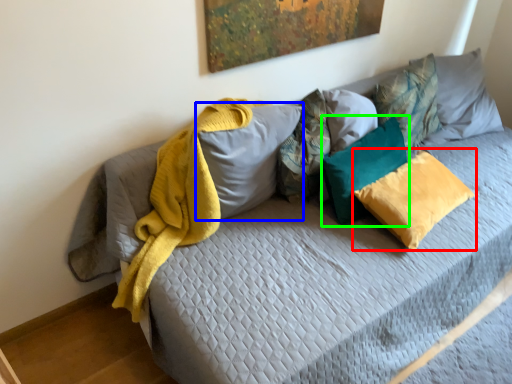
Question: Considering the real-world distances, which object is closest to pillow (highlighted by a red box)? pillow (highlighted by a blue box) or pillow (highlighted by a green box).

Choices:
 (A) pillow
 (B) pillow

Answer: (B)